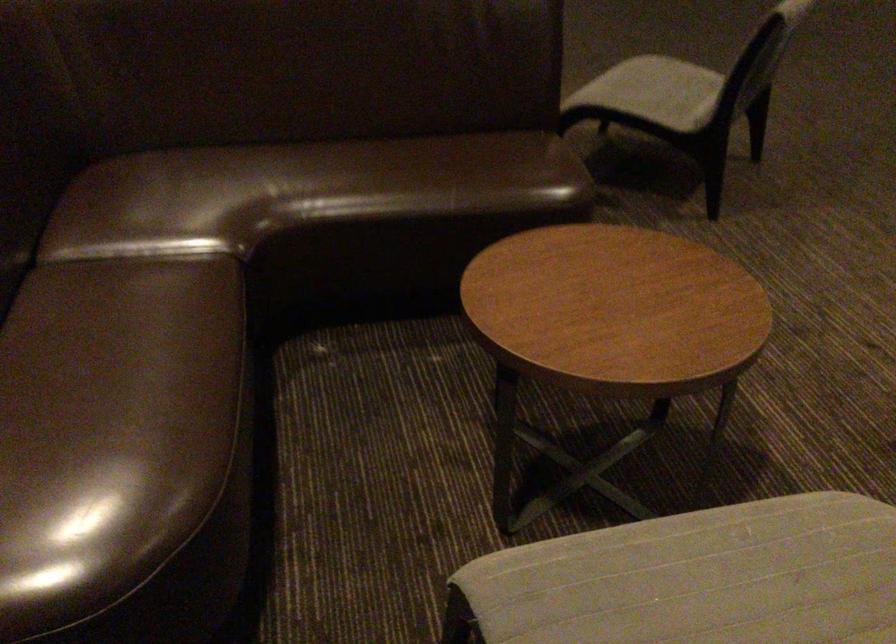
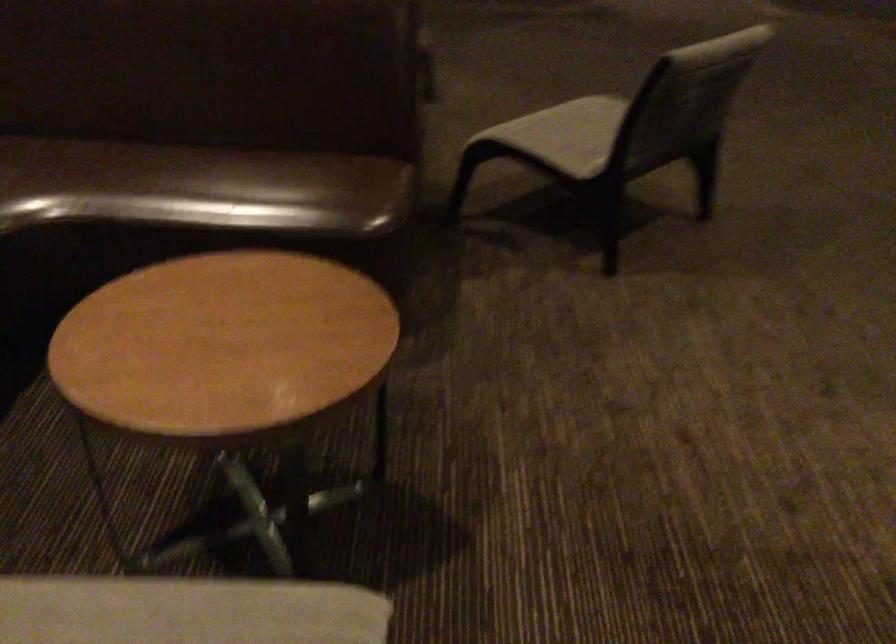
Question: Which direction would the cameraman need to move to produce the second image? Reply with the corresponding letter.

Choices:
 (A) Left
 (B) Right
 (C) Forward
 (D) Backward

Answer: (B)